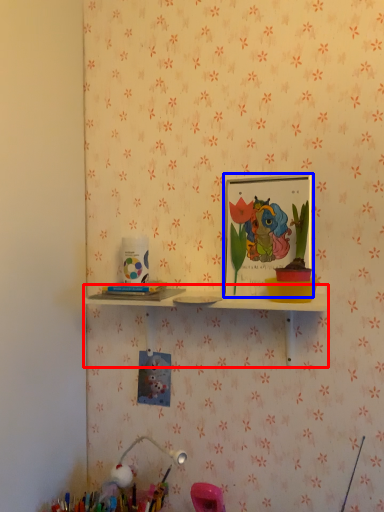
Question: Which point is closer to the camera, shelf (highlighted by a red box) or picture frame (highlighted by a blue box)?

Choices:
 (A) shelf
 (B) picture frame

Answer: (A)